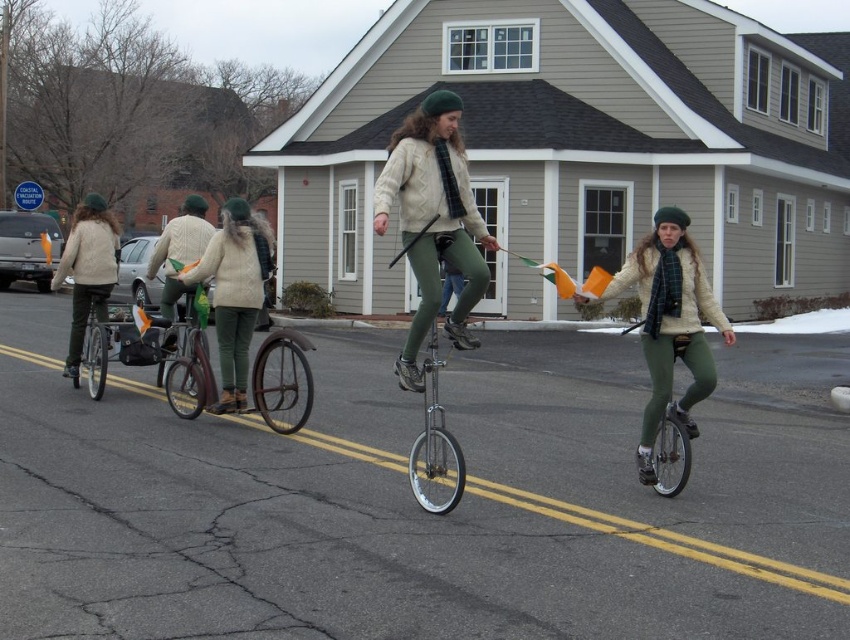
Is silver metallic unicycle at center to the right of matte black bicycle at left from the viewer's perspective?

Yes, silver metallic unicycle at center is to the right of matte black bicycle at left.

Does silver metallic unicycle at center appear under matte black bicycle at left?

No, silver metallic unicycle at center is not below matte black bicycle at left.

Identify the location of silver metallic unicycle at center. The image size is (850, 640). (432, 433).

Who is shorter, white knit sweater at center or shiny silver unicycle at center?

With less height is shiny silver unicycle at center.

Can you confirm if white knit sweater at center is positioned to the left of shiny silver unicycle at center?

Indeed, white knit sweater at center is positioned on the left side of shiny silver unicycle at center.

This screenshot has width=850, height=640. What are the coordinates of `white knit sweater at center` in the screenshot? It's located at (234, 292).

From the picture: Does brown leather bicycle at center appear under matte white sweater at left?

Indeed, brown leather bicycle at center is positioned under matte white sweater at left.

Can you confirm if brown leather bicycle at center is positioned above matte white sweater at left?

No.

Does point (174, 406) lie behind point (82, 257)?

No, (174, 406) is closer to viewer.

This screenshot has height=640, width=850. In order to click on brown leather bicycle at center in this screenshot , I will do `click(281, 378)`.